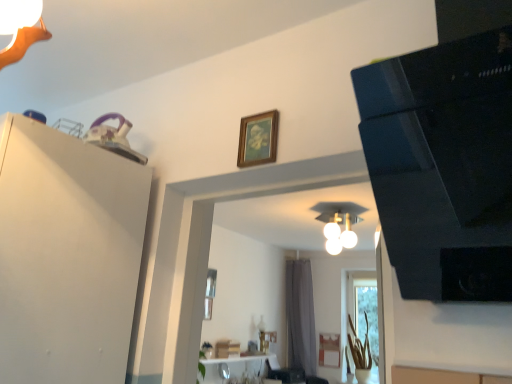
Question: Considering the relative sizes of white glossy light fixture at center and translucent glass vase at lower right in the image provided, is white glossy light fixture at center smaller than translucent glass vase at lower right?

Choices:
 (A) yes
 (B) no

Answer: (A)

Question: Could you tell me if white glossy light fixture at center is turned towards translucent glass vase at lower right?

Choices:
 (A) no
 (B) yes

Answer: (A)

Question: From the image's perspective, is white glossy light fixture at center below translucent glass vase at lower right?

Choices:
 (A) yes
 (B) no

Answer: (B)

Question: Is white glossy light fixture at center not inside translucent glass vase at lower right?

Choices:
 (A) yes
 (B) no

Answer: (A)

Question: Does white glossy light fixture at center appear on the right side of translucent glass vase at lower right?

Choices:
 (A) yes
 (B) no

Answer: (B)

Question: Visually, is gray fabric curtain at center positioned to the left or to the right of white glossy light fixture at center?

Choices:
 (A) right
 (B) left

Answer: (B)

Question: From the image's perspective, is gray fabric curtain at center above or below white glossy light fixture at center?

Choices:
 (A) below
 (B) above

Answer: (A)

Question: Is gray fabric curtain at center situated inside white glossy light fixture at center or outside?

Choices:
 (A) inside
 (B) outside

Answer: (B)

Question: Is gray fabric curtain at center bigger or smaller than white glossy light fixture at center?

Choices:
 (A) small
 (B) big

Answer: (B)

Question: Do you think white matte dresser at upper left is within gray fabric curtain at center, or outside of it?

Choices:
 (A) inside
 (B) outside

Answer: (B)

Question: In terms of width, does white matte dresser at upper left look wider or thinner when compared to gray fabric curtain at center?

Choices:
 (A) thin
 (B) wide

Answer: (B)

Question: Does point (45, 139) appear closer or farther from the camera than point (292, 331)?

Choices:
 (A) closer
 (B) farther

Answer: (A)

Question: Relative to gray fabric curtain at center, is white matte dresser at upper left in front or behind?

Choices:
 (A) front
 (B) behind

Answer: (A)

Question: From the image's perspective, relative to translucent glass vase at lower right, is gray fabric curtain at center above or below?

Choices:
 (A) above
 (B) below

Answer: (A)

Question: Is gray fabric curtain at center in front of or behind translucent glass vase at lower right in the image?

Choices:
 (A) behind
 (B) front

Answer: (A)